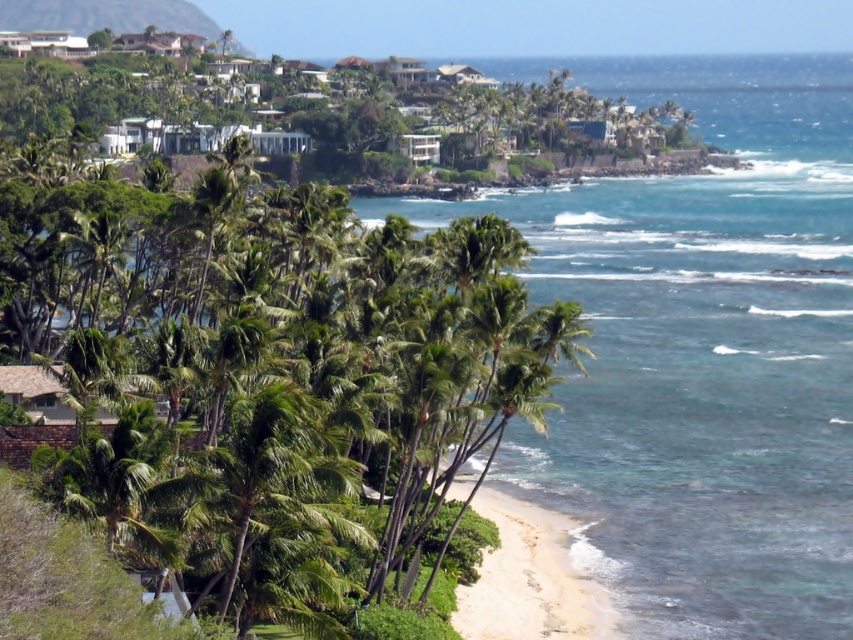
You are standing on the white sand beach at lower center and want to reach the clear blue water at center. Which direction should you walk to get to the water?

You should walk forward because the clear blue water at center is located above the white sand beach at lower center, meaning it is in front of you.

You are standing on the beach and want to take a photo of both the green leafy palm tree at center and the clear blue water at center. Which object will appear larger in the photo?

The green leafy palm tree at center will appear larger in the photo because it is closer to the viewer than the clear blue water at center.